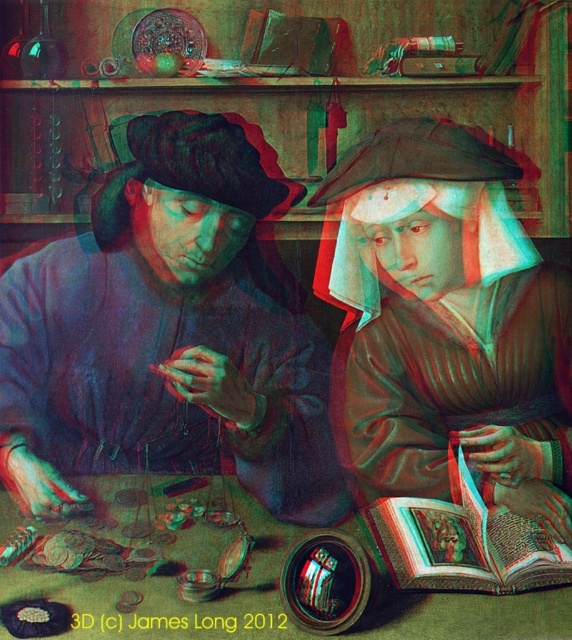
Which of these two, wooden table at center or brown leather book at center, stands taller?

Standing taller between the two is wooden table at center.

Is wooden table at center wider than brown leather book at center?

Yes.

Describe the element at coordinates (146, 563) in the screenshot. This screenshot has width=572, height=640. I see `wooden table at center` at that location.

Image resolution: width=572 pixels, height=640 pixels. I want to click on wooden table at center, so click(146, 563).

Between point (137, 413) and point (384, 164), which one is positioned behind?

The point (384, 164) is behind.

Which is in front, point (15, 317) or point (363, 385)?

Point (15, 317) is more forward.

At what (x,y) coordinates should I click in order to perform the action: click on matte brown coat at center-left. Please return your answer as a coordinate pair (x, y). The width and height of the screenshot is (572, 640). Looking at the image, I should click on (166, 337).

Based on the photo, measure the distance between matte brown robe at center and camera.

They are 2.00 meters apart.

Is matte brown robe at center below wooden table at center?

No, matte brown robe at center is not below wooden table at center.

Find the location of a particular element. This screenshot has height=640, width=572. matte brown robe at center is located at coordinates (446, 321).

Where is `matte brown robe at center`? The image size is (572, 640). matte brown robe at center is located at coordinates (446, 321).